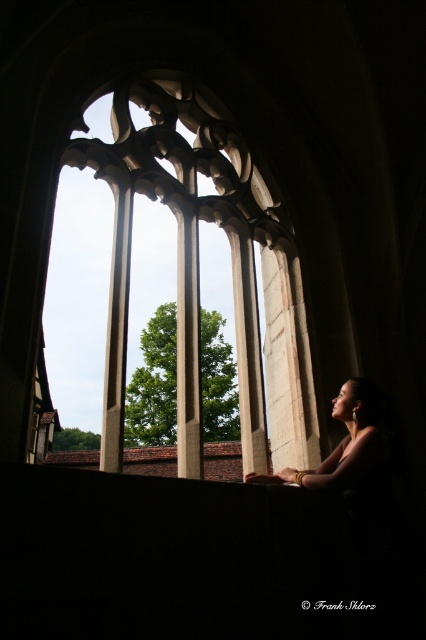
You are an interior designer planning to install a new bench in this historic stone structure. The bench needs to be as wide as the smooth skin woman at center. Will the white stone window at center provide enough space for the bench to fit horizontally?

The white stone window at center is wider than the smooth skin woman at center, so yes, the bench can fit horizontally as the window provides sufficient space.

You are a tour guide leading a group through this historic building. You want to ensure the safety of the visitors near the white stone window at center and the smooth skin woman at center. What is the minimum safe distance you should maintain between these two objects to prevent accidents?

The minimum safe distance between the white stone window at center and the smooth skin woman at center should be at least 5.18 meters to prevent accidents, as they are currently 5.18 meters apart.

You are standing in the historic stone structure and want to take a photo of the white stone window at center. To ensure the window is centered in your photo, where should you position yourself relative to the window?

To center the white stone window at center in your photo, you should position yourself directly in front of the window at the coordinates corresponding to its center point, which is at location [198,262]. This ensures the window is perfectly framed in the center of your image.